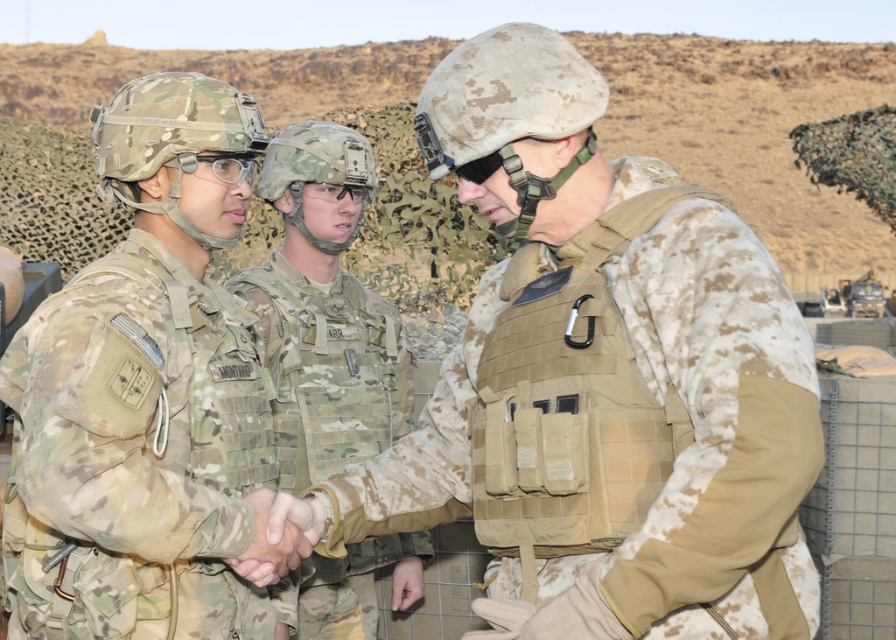
Does camouflage fabric vest at center appear under camouflage fabric uniform at center?

Actually, camouflage fabric vest at center is above camouflage fabric uniform at center.

Does camouflage fabric vest at center appear on the left side of camouflage fabric uniform at center?

No, camouflage fabric vest at center is not to the left of camouflage fabric uniform at center.

Between point (747, 476) and point (122, 420), which one is positioned in front?

Positioned in front is point (747, 476).

Locate an element on the screen. camouflage fabric vest at center is located at coordinates (600, 378).

Can you confirm if camouflage fabric uniform at center is bigger than multicam fabric uniform at center?

Incorrect, camouflage fabric uniform at center is not larger than multicam fabric uniform at center.

Can you confirm if camouflage fabric uniform at center is wider than multicam fabric uniform at center?

No.

Does point (174, 360) lie behind point (341, 316)?

No, it is not.

What are the coordinates of `camouflage fabric uniform at center` in the screenshot? It's located at click(136, 452).

Between camouflage fabric vest at center and multicam fabric uniform at center, which one is positioned higher?

Positioned higher is camouflage fabric vest at center.

Is camouflage fabric vest at center thinner than multicam fabric uniform at center?

Incorrect, camouflage fabric vest at center's width is not less than multicam fabric uniform at center's.

Which is in front, point (729, 273) or point (252, 280)?

Point (729, 273) is in front.

This screenshot has width=896, height=640. Find the location of `camouflage fabric vest at center`. camouflage fabric vest at center is located at coordinates [x=600, y=378].